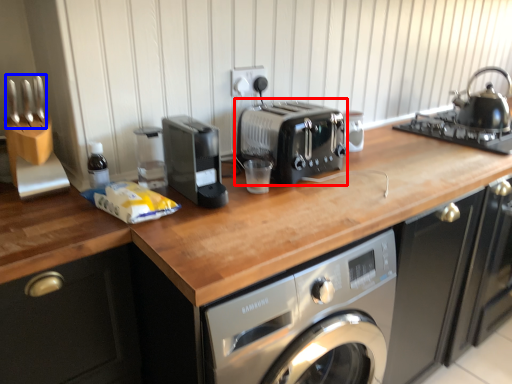
Question: Which of the following is the farthest to the observer, toaster (highlighted by a red box) or cutlery (highlighted by a blue box)?

Choices:
 (A) toaster
 (B) cutlery

Answer: (A)